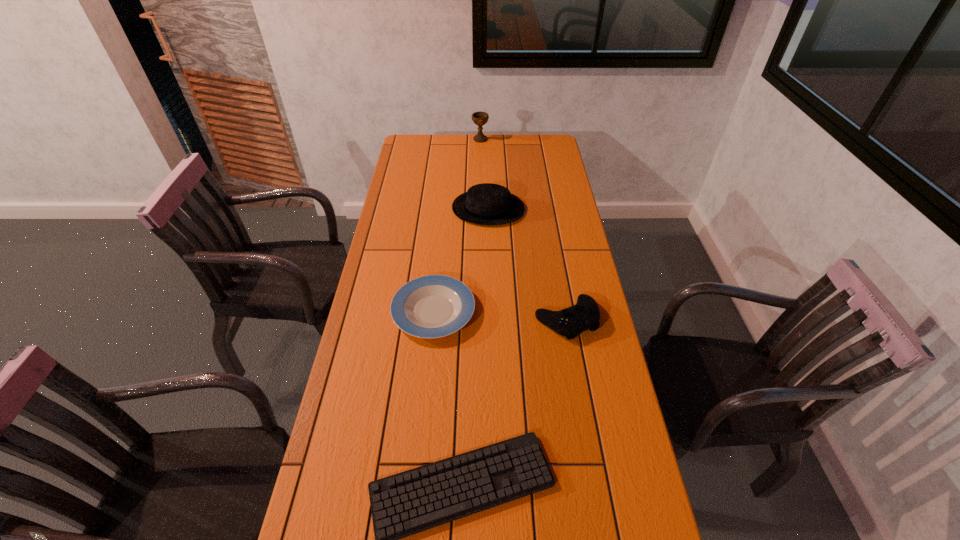
I want to click on object that is at the far edge, so click(x=480, y=118).

Identify the location of object located in the left edge section of the desktop. (433, 306).

The image size is (960, 540). In order to click on object at the right edge in this screenshot , I will do `click(584, 315)`.

Identify the location of free location at the far edge of the desktop. (447, 140).

The image size is (960, 540). Identify the location of vacant space at the left edge of the desktop. (351, 502).

This screenshot has width=960, height=540. What are the coordinates of `free space at the right edge of the desktop` in the screenshot? It's located at (572, 205).

This screenshot has height=540, width=960. I want to click on vacant space at the far left corner of the desktop, so click(x=415, y=156).

Where is `vacant space at the far right corner of the desktop`? vacant space at the far right corner of the desktop is located at coordinates (549, 141).

Where is `vacant space that is in between the control and the farthest object`? This screenshot has height=540, width=960. vacant space that is in between the control and the farthest object is located at coordinates (523, 230).

What are the coordinates of `empty space between the second farthest object and the farthest object` in the screenshot? It's located at (x=484, y=174).